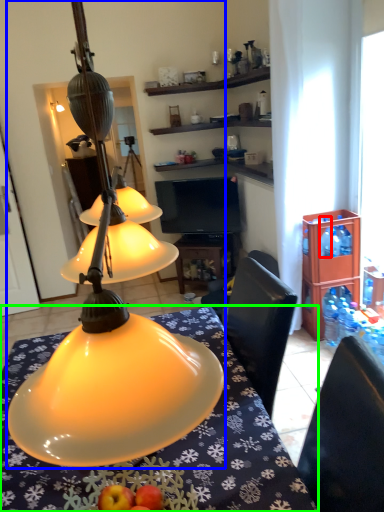
Question: Which object is positioned farthest from bottle (highlighted by a red box)? Select from lamp (highlighted by a blue box) and desk (highlighted by a green box).

Choices:
 (A) lamp
 (B) desk

Answer: (A)